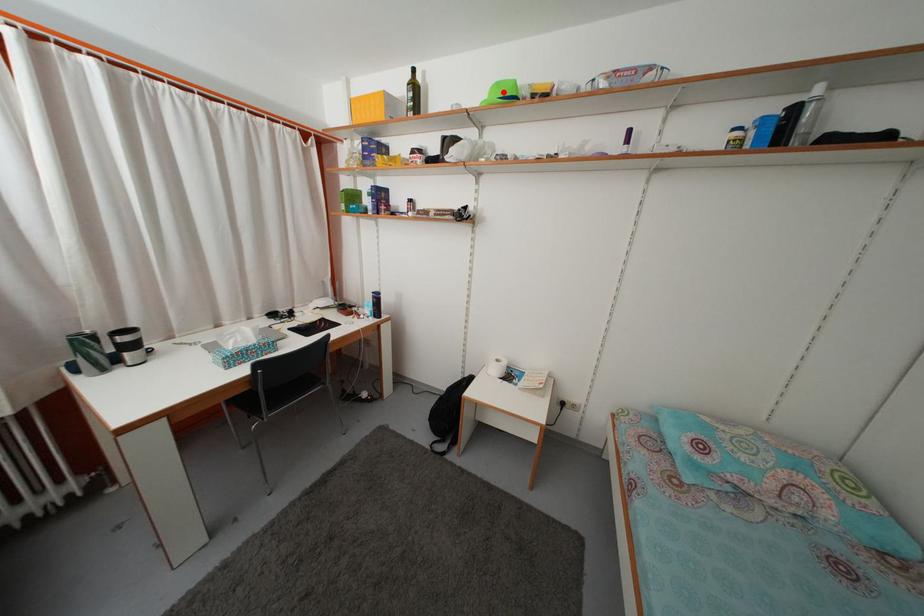
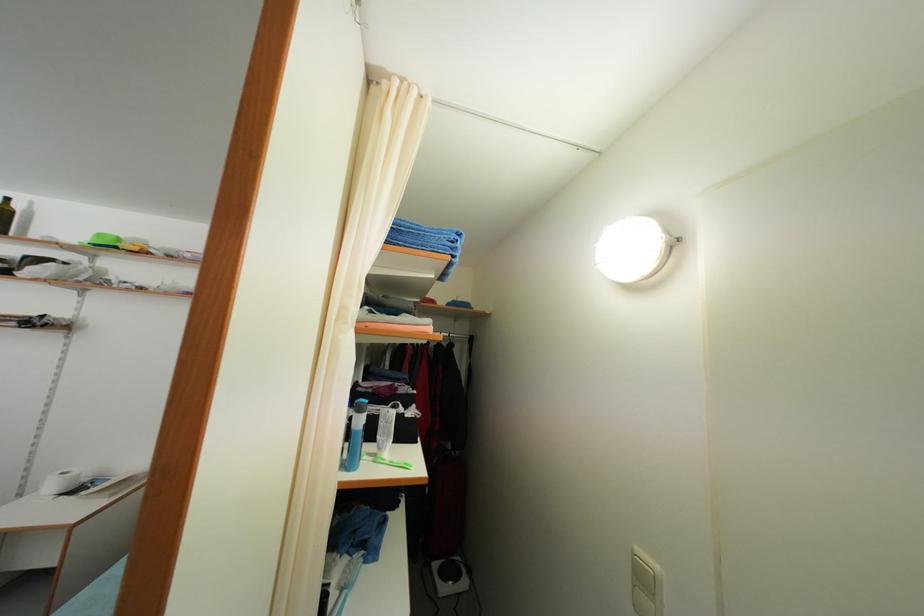
The point at the highlighted location is marked in the first image. Where is the corresponding point in the second image?

(104, 243)